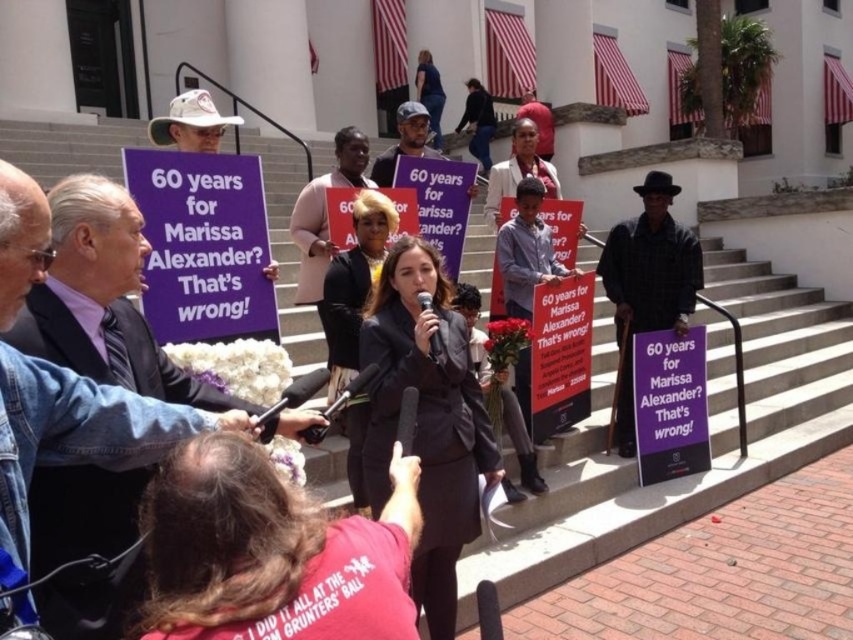
Question: Which point appears closest to the camera in this image?

Choices:
 (A) (653, 230)
 (B) (96, 225)

Answer: (B)

Question: Can you confirm if dark suit at center is positioned to the left of black hat at center?

Choices:
 (A) no
 (B) yes

Answer: (B)

Question: From the image, what is the correct spatial relationship of dark suit at center in relation to black hat at center?

Choices:
 (A) right
 (B) left

Answer: (B)

Question: Does dark suit at center lie in front of black hat at center?

Choices:
 (A) no
 (B) yes

Answer: (B)

Question: Which point is farther to the camera?

Choices:
 (A) dark suit at center
 (B) black hat at center

Answer: (B)